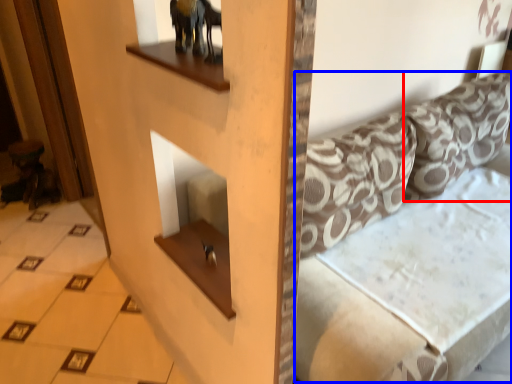
Question: Which point is closer to the camera, pillow (highlighted by a red box) or couch (highlighted by a blue box)?

Choices:
 (A) pillow
 (B) couch

Answer: (B)